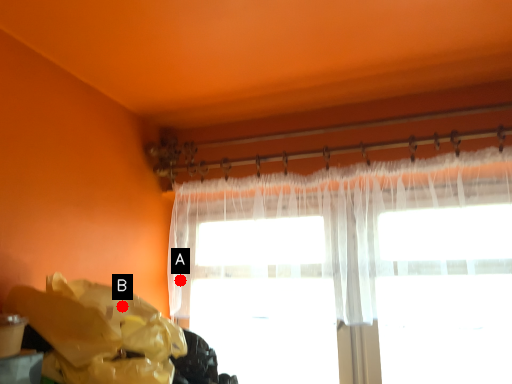
Question: Two points are circled on the image, labeled by A and B beside each circle. Which point is closer to the camera?

Choices:
 (A) A is closer
 (B) B is closer

Answer: (B)